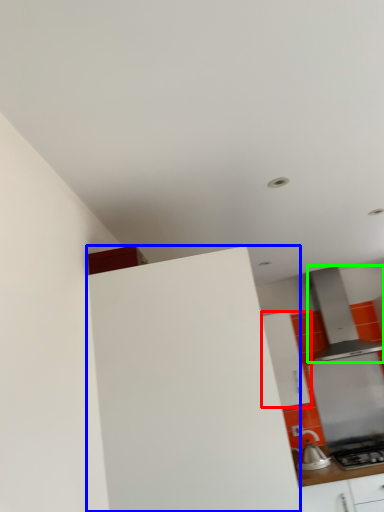
Question: Based on their relative distances, which object is farther from cabinetry (highlighted by a red box)? Choose from cabinetry (highlighted by a blue box) and home appliance (highlighted by a green box).

Choices:
 (A) cabinetry
 (B) home appliance

Answer: (A)